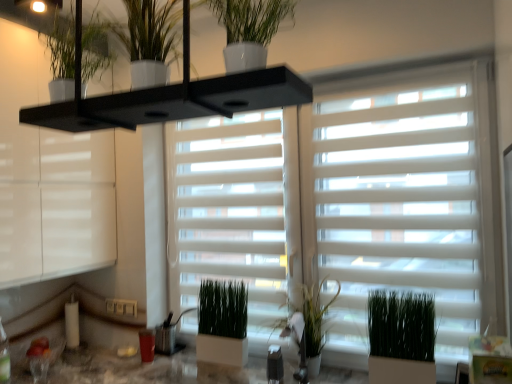
This screenshot has width=512, height=384. What do you see at coordinates (222, 323) in the screenshot?
I see `green matte plant at center, which is counted as the 5th houseplant, starting from the top` at bounding box center [222, 323].

Describe the element at coordinates (249, 29) in the screenshot. I see `white glossy pot at upper center, the first houseplant positioned from the front` at that location.

In order to click on green matte plant at center, the third houseplant in the back-to-front sequence in this screenshot , I will do `click(401, 337)`.

Locate an element on the screen. The width and height of the screenshot is (512, 384). white matte window blind at center is located at coordinates (341, 204).

Where is `green matte plant at upper center, which is the 2th houseplant in front-to-back order`? The image size is (512, 384). green matte plant at upper center, which is the 2th houseplant in front-to-back order is located at coordinates (149, 39).

Could you tell me if green matte plant at upper center, which is the 2th houseplant in front-to-back order, is turned towards white glossy window frame at upper left?

No, green matte plant at upper center, which is the 2th houseplant in front-to-back order, is not aimed at white glossy window frame at upper left.

How far apart are green matte plant at upper center, which is the 2th houseplant in front-to-back order, and white glossy window frame at upper left?

green matte plant at upper center, which is the 2th houseplant in front-to-back order, is 3.89 feet from white glossy window frame at upper left.

Looking at this image, from a real-world perspective, is green matte plant at upper center, arranged as the fourth houseplant when viewed from the back, under white glossy window frame at upper left?

No, from a real-world perspective, green matte plant at upper center, arranged as the fourth houseplant when viewed from the back, is not under white glossy window frame at upper left.

Considering the relative positions of green matte plant at center, placed as the fourth houseplant when sorted from top to bottom, and white glossy pot at upper center, the 5th houseplant when ordered from back to front, in the image provided, is green matte plant at center, placed as the fourth houseplant when sorted from top to bottom, to the right of white glossy pot at upper center, the 5th houseplant when ordered from back to front, from the viewer's perspective?

Indeed, green matte plant at center, placed as the fourth houseplant when sorted from top to bottom, is positioned on the right side of white glossy pot at upper center, the 5th houseplant when ordered from back to front.

Looking at their sizes, would you say green matte plant at center, the third houseplant in the back-to-front sequence, is wider or thinner than white glossy pot at upper center, the 4th houseplant from the bottom?

green matte plant at center, the third houseplant in the back-to-front sequence, is thinner than white glossy pot at upper center, the 4th houseplant from the bottom.

From a real-world perspective, which object stands above the other?

From a 3D spatial view, white glossy pot at upper center, which is the 2th houseplant from top to bottom, is above.

From the image's perspective, relative to white glossy pot at upper center, the 4th houseplant from the bottom, is green matte plant at center, the third houseplant in the back-to-front sequence, above or below?

Based on their image positions, green matte plant at center, the third houseplant in the back-to-front sequence, is located beneath white glossy pot at upper center, the 4th houseplant from the bottom.

Would you say green matte plant at upper center, arranged as the fourth houseplant when viewed from the back, is inside or outside green matte plant at center, the 1th houseplant ordered from the bottom?

green matte plant at upper center, arranged as the fourth houseplant when viewed from the back, exists outside the volume of green matte plant at center, the 1th houseplant ordered from the bottom.

Looking at this image, which object is closer to the camera, green matte plant at upper center, which ranks as the first houseplant in top-to-bottom order, or green matte plant at center, the 1th houseplant ordered from the bottom?

green matte plant at upper center, which ranks as the first houseplant in top-to-bottom order, is closer to the camera.

From the picture: From a real-world perspective, is green matte plant at upper center, the 5th houseplant when ordered from bottom to top, above or below green matte plant at center, which is counted as the 5th houseplant, starting from the top?

In terms of real-world spatial position, green matte plant at upper center, the 5th houseplant when ordered from bottom to top, is above green matte plant at center, which is counted as the 5th houseplant, starting from the top.

In the scene shown: Measure the distance from green matte plant at upper center, arranged as the fourth houseplant when viewed from the back, to green matte plant at center, which is counted as the 1th houseplant, starting from the back.

green matte plant at upper center, arranged as the fourth houseplant when viewed from the back, is 1.42 meters from green matte plant at center, which is counted as the 1th houseplant, starting from the back.

Image resolution: width=512 pixels, height=384 pixels. What are the coordinates of `window frame located behind the white glossy pot at upper center, which is the 2th houseplant from top to bottom` in the screenshot? It's located at (48, 178).

From a real-world perspective, which is physically below, white glossy pot at upper center, the 4th houseplant from the bottom, or white glossy window frame at upper left?

white glossy window frame at upper left.

Is white glossy pot at upper center, the 4th houseplant from the bottom, spatially inside white glossy window frame at upper left, or outside of it?

white glossy pot at upper center, the 4th houseplant from the bottom, lies outside white glossy window frame at upper left.

What's the angular difference between white glossy pot at upper center, which is the 2th houseplant from top to bottom, and white glossy window frame at upper left's facing directions?

The angular difference between white glossy pot at upper center, which is the 2th houseplant from top to bottom, and white glossy window frame at upper left is 81.9 degrees.

Considering the positions of objects green matte plant at center, which appears as the 5th houseplant when viewed from the front, and white glossy window frame at upper left in the image provided, who is behind, green matte plant at center, which appears as the 5th houseplant when viewed from the front, or white glossy window frame at upper left?

green matte plant at center, which appears as the 5th houseplant when viewed from the front, is more distant.

Does green matte plant at center, the 1th houseplant ordered from the bottom, have a lesser width compared to white glossy window frame at upper left?

Indeed, green matte plant at center, the 1th houseplant ordered from the bottom, has a lesser width compared to white glossy window frame at upper left.

Considering the relative sizes of green matte plant at center, which appears as the 5th houseplant when viewed from the front, and white glossy window frame at upper left in the image provided, is green matte plant at center, which appears as the 5th houseplant when viewed from the front, bigger than white glossy window frame at upper left?

No.

Who is shorter, green matte plant at center, which appears as the 5th houseplant when viewed from the front, or white glossy window frame at upper left?

green matte plant at center, which appears as the 5th houseplant when viewed from the front.

From the image's perspective, starting from the green matte plant at center, placed as the fourth houseplant when sorted from top to bottom, which houseplant is the 1st one above? Please provide its 2D coordinates.

[(307, 329)]

Is green matte plant at center, which is the 3th houseplant in bottom-to-top order, in front of or behind green matte plant at center, placed as the fourth houseplant when sorted from top to bottom, in the image?

Clearly, green matte plant at center, which is the 3th houseplant in bottom-to-top order, is behind green matte plant at center, placed as the fourth houseplant when sorted from top to bottom.

Are green matte plant at center, which is the 3th houseplant in bottom-to-top order, and green matte plant at center, placed as the fourth houseplant when sorted from top to bottom, far apart?

No, there isn't a large distance between green matte plant at center, which is the 3th houseplant in bottom-to-top order, and green matte plant at center, placed as the fourth houseplant when sorted from top to bottom.

Considering the positions of point (308, 379) and point (383, 302), is point (308, 379) closer or farther from the camera than point (383, 302)?

Clearly, point (308, 379) is more distant from the camera than point (383, 302).

Measure the distance from green matte plant at upper center, which is the 2th houseplant in front-to-back order, to white glossy pot at upper center, which is the 2th houseplant from top to bottom.

They are 7.75 inches apart.

Considering the sizes of objects green matte plant at upper center, the 5th houseplant when ordered from bottom to top, and white glossy pot at upper center, the 5th houseplant when ordered from back to front, in the image provided, who is smaller, green matte plant at upper center, the 5th houseplant when ordered from bottom to top, or white glossy pot at upper center, the 5th houseplant when ordered from back to front,?

white glossy pot at upper center, the 5th houseplant when ordered from back to front.

Looking at their sizes, would you say green matte plant at upper center, the 5th houseplant when ordered from bottom to top, is wider or thinner than white glossy pot at upper center, the 4th houseplant from the bottom?

Considering their sizes, green matte plant at upper center, the 5th houseplant when ordered from bottom to top, looks broader than white glossy pot at upper center, the 4th houseplant from the bottom.

Who is shorter, green matte plant at upper center, which ranks as the first houseplant in top-to-bottom order, or white glossy pot at upper center, the 5th houseplant when ordered from back to front?

With less height is white glossy pot at upper center, the 5th houseplant when ordered from back to front.

Locate an element on the screen. The image size is (512, 384). the 1st houseplant to the right when counting from the white glossy window frame at upper left is located at coordinates (149, 39).

Starting from the white glossy pot at upper center, the first houseplant positioned from the front, which houseplant is the 2nd one behind? Please provide its 2D coordinates.

[(401, 337)]

From the image, which object appears to be farther from white glossy pot at upper center, the 4th houseplant from the bottom, green matte plant at center, which is the 3th houseplant in front-to-back order, or green matte plant at center, which is the 3th houseplant in bottom-to-top order?

The object further to white glossy pot at upper center, the 4th houseplant from the bottom, is green matte plant at center, which is the 3th houseplant in bottom-to-top order.

Looking at the image, which one is located closer to white glossy pot at upper center, the 5th houseplant when ordered from back to front, green matte plant at center, the 1th houseplant ordered from the bottom, or green matte plant at center, which is the 3th houseplant in bottom-to-top order?

Among the two, green matte plant at center, which is the 3th houseplant in bottom-to-top order, is located nearer to white glossy pot at upper center, the 5th houseplant when ordered from back to front.

Considering their positions, is green matte plant at center, placed as the fourth houseplant when sorted from top to bottom, positioned further to green matte plant at center, the 1th houseplant ordered from the bottom, than green matte plant at upper center, the 5th houseplant when ordered from bottom to top?

green matte plant at upper center, the 5th houseplant when ordered from bottom to top.

Which object lies further to the anchor point green matte plant at center, which is the 3th houseplant in top-to-bottom order, green matte plant at center, which appears as the 5th houseplant when viewed from the front, or green matte plant at upper center, which is the 2th houseplant in front-to-back order?

Among the two, green matte plant at upper center, which is the 2th houseplant in front-to-back order, is located further to green matte plant at center, which is the 3th houseplant in top-to-bottom order.

Based on their spatial positions, is green matte plant at upper center, the 5th houseplant when ordered from bottom to top, or green matte plant at center, which is the 3th houseplant in front-to-back order, further from white matte window blind at center?

green matte plant at upper center, the 5th houseplant when ordered from bottom to top, is further to white matte window blind at center.

Which object lies further to the anchor point white glossy window frame at upper left, white matte window blind at center or green matte plant at center, placed as the fourth houseplant when sorted from top to bottom?

green matte plant at center, placed as the fourth houseplant when sorted from top to bottom, lies further to white glossy window frame at upper left than the other object.

Considering their positions, is white glossy pot at upper center, the 4th houseplant from the bottom, positioned closer to green matte plant at center, which ranks as the second houseplant in back-to-front order, than white matte window blind at center?

white matte window blind at center is closer to green matte plant at center, which ranks as the second houseplant in back-to-front order.

From the image, which object appears to be farther from white glossy window frame at upper left, green matte plant at center, placed as the fourth houseplant when sorted from top to bottom, or green matte plant at center, which is counted as the 5th houseplant, starting from the top?

green matte plant at center, placed as the fourth houseplant when sorted from top to bottom, is positioned further to the anchor white glossy window frame at upper left.

The height and width of the screenshot is (384, 512). In order to click on window blind between green matte plant at center, which is counted as the 5th houseplant, starting from the top, and green matte plant at center, the 2th houseplant from the bottom in this screenshot , I will do `click(341, 204)`.

Locate an element on the screen. houseplant between white matte window blind at center and green matte plant at center, placed as the fourth houseplant when sorted from top to bottom, in the vertical direction is located at coordinates (307, 329).

Locate an element on the screen. This screenshot has width=512, height=384. houseplant between white glossy pot at upper center, which is the 2th houseplant from top to bottom, and green matte plant at center, the third houseplant in the back-to-front sequence, from top to bottom is located at coordinates (307, 329).

Locate an element on the screen. window blind situated between white glossy window frame at upper left and green matte plant at center, placed as the fourth houseplant when sorted from top to bottom, from left to right is located at coordinates (341, 204).